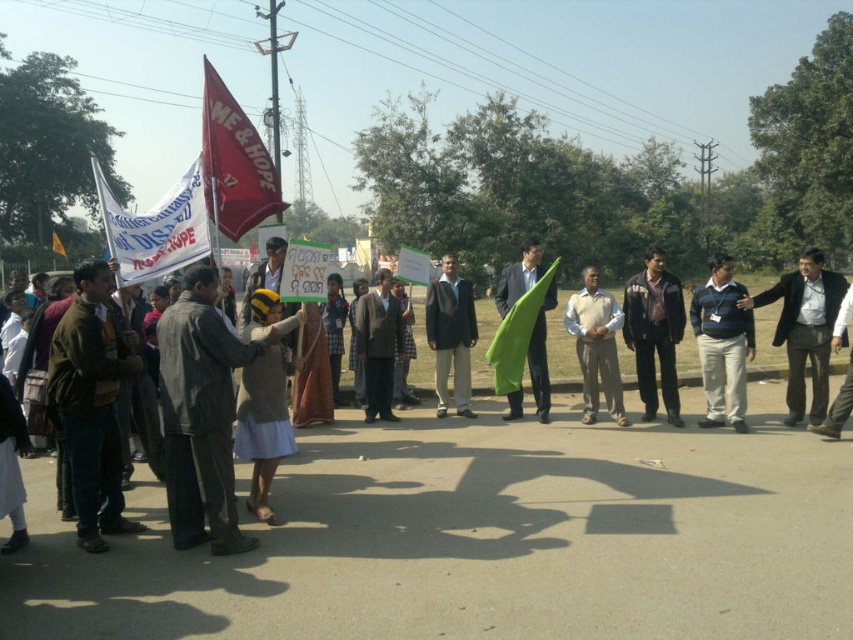
Question: Is white fabric banner at left smaller than green fabric at center?

Choices:
 (A) no
 (B) yes

Answer: (A)

Question: Where is brown leather jacket at left located in relation to dark brown leather jacket at center in the image?

Choices:
 (A) below
 (B) above

Answer: (A)

Question: Based on their relative distances, which object is farther from the red fabric flag at center?

Choices:
 (A) dark gray suit at right
 (B) white fabric banner at left
 (C) dark gray suit at center

Answer: (A)

Question: Which of the following is the farthest from the observer?

Choices:
 (A) red fabric flag at upper left
 (B) dark brown suit at center
 (C) white fabric banner at left
 (D) black leather jacket at center

Answer: (B)

Question: Estimate the real-world distances between objects in this image. Which object is farther from the striped fabric jacket at center?

Choices:
 (A) red fabric flag at upper left
 (B) dark brown suit at center
 (C) dark gray suit at right

Answer: (C)

Question: Where is black leather jacket at center located in relation to green fabric at center in the image?

Choices:
 (A) above
 (B) below

Answer: (B)